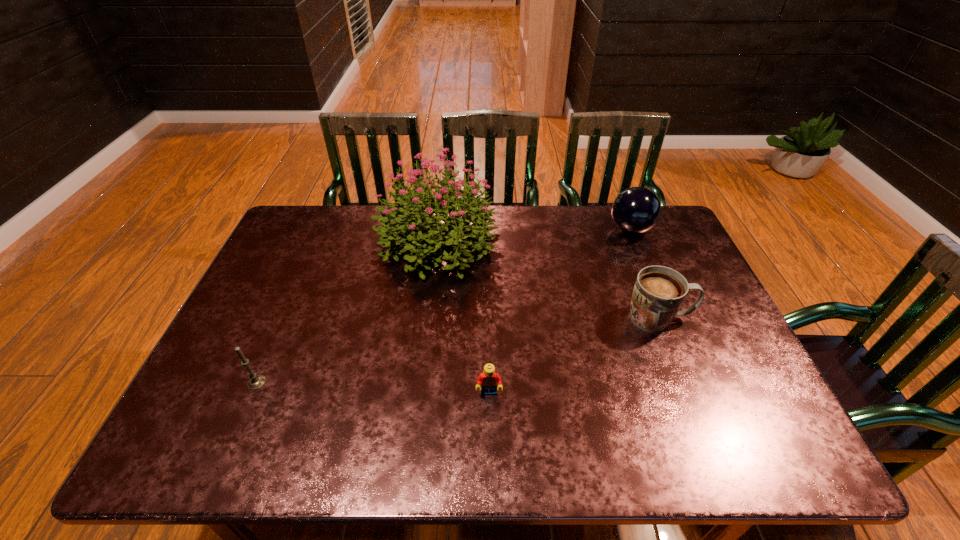
You are a GUI agent. You are given a task and a screenshot of the screen. Output one action in this format:
    pyautogui.click(x=<x>, y=<y>)
    Task: Click on the empty space between the mug and the Lego
    
    Given the screenshot: What is the action you would take?
    pyautogui.click(x=574, y=355)

Find the location of a particular element. This screenshot has height=540, width=960. vacant point located between the bowling ball and the Lego is located at coordinates (560, 311).

Locate which object ranks third in proximity to the bowling ball. Please provide its 2D coordinates. Your answer should be formatted as a tuple, i.e. [(x, y)], where the tuple contains the x and y coordinates of a point satisfying the conditions above.

[(488, 379)]

Select which object appears as the second closest to the mug. Please provide its 2D coordinates. Your answer should be formatted as a tuple, i.e. [(x, y)], where the tuple contains the x and y coordinates of a point satisfying the conditions above.

[(422, 207)]

The image size is (960, 540). What are the coordinates of `vacant space that satisfies the following two spatial constraints: 1. on the side of the bowling ball with the finger holes; 2. on the face of the shortest object` in the screenshot? It's located at tap(698, 393).